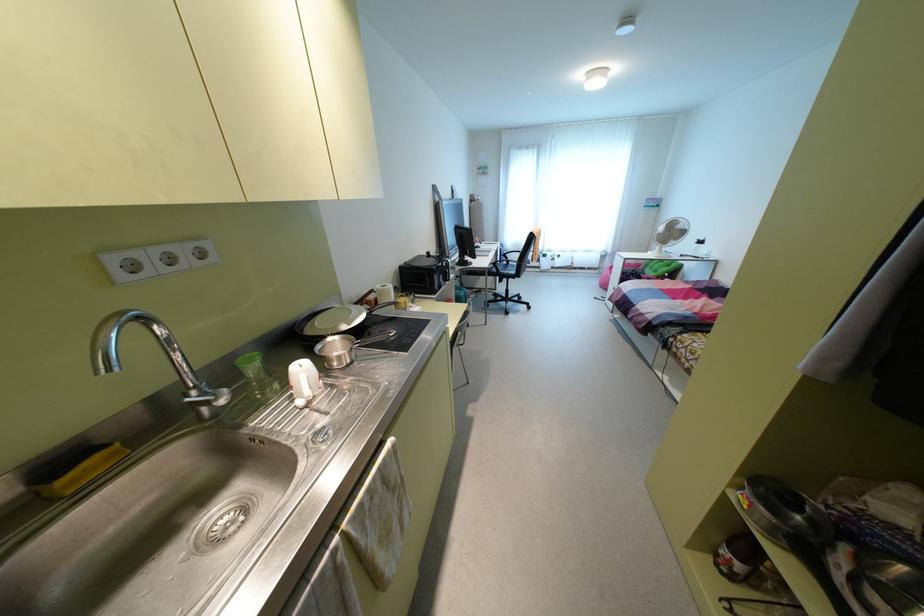
Find where to lift the white electric fan. Please return your answer as a coordinate pair (x, y).

(669, 233)